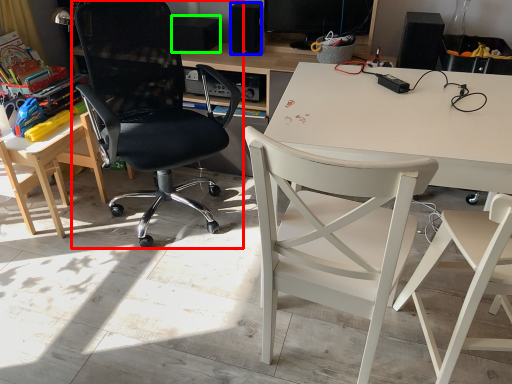
Question: Based on their relative distances, which object is farther from chair (highlighted by a red box)? Choose from loudspeaker (highlighted by a blue box) and loudspeaker (highlighted by a green box).

Choices:
 (A) loudspeaker
 (B) loudspeaker

Answer: (A)